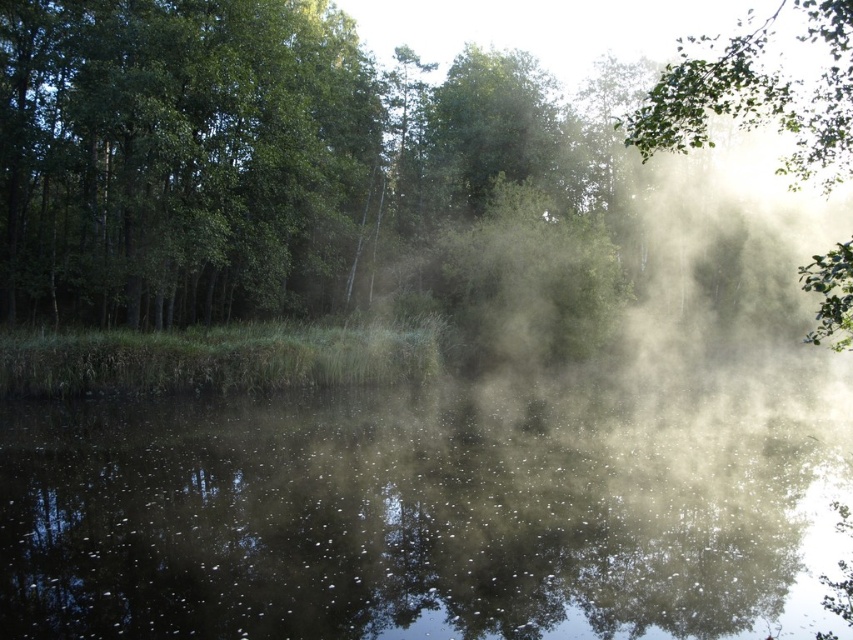
You are standing in the misty waterscape scene and want to move from one point to another. Which of the two points, point (68, 72) or point (233, 128), is closer to you?

Point (68, 72) is closer to the viewer than point (233, 128).

You are an artist trying to capture the scene. You want to paint the translucent misty water at center and the green leafy tree at left. Which object should you paint first if you follow the rule of painting smaller objects before larger ones?

The translucent misty water at center should be painted first because it has a smaller size compared to the green leafy tree at left.